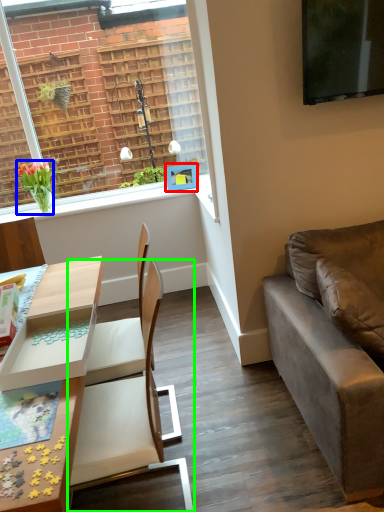
Question: Estimate the real-world distances between objects in this image. Which object is closer to picture frame (highlighted by a red box), houseplant (highlighted by a blue box) or chair (highlighted by a green box)?

Choices:
 (A) houseplant
 (B) chair

Answer: (A)